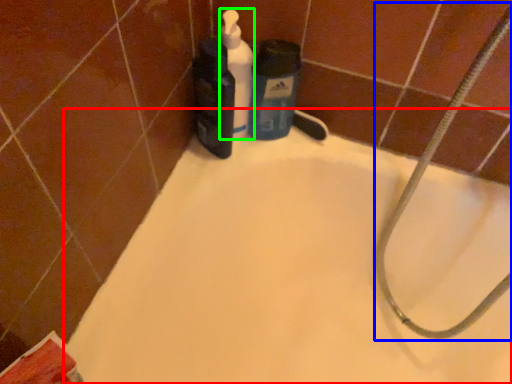
Question: Which is farther away from bathtub (highlighted by a red box)? garden hose (highlighted by a blue box) or cleaning product (highlighted by a green box)?

Choices:
 (A) garden hose
 (B) cleaning product

Answer: (B)